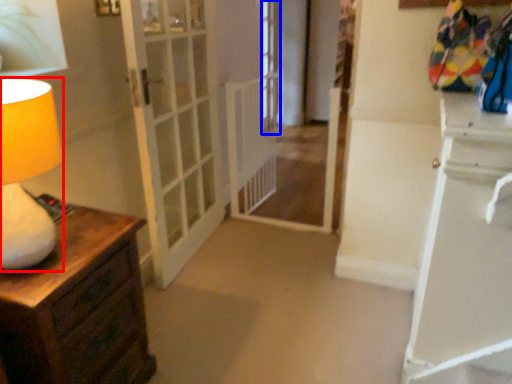
Question: Which object appears farthest to the camera in this image, table lamp (highlighted by a red box) or window (highlighted by a blue box)?

Choices:
 (A) table lamp
 (B) window

Answer: (B)